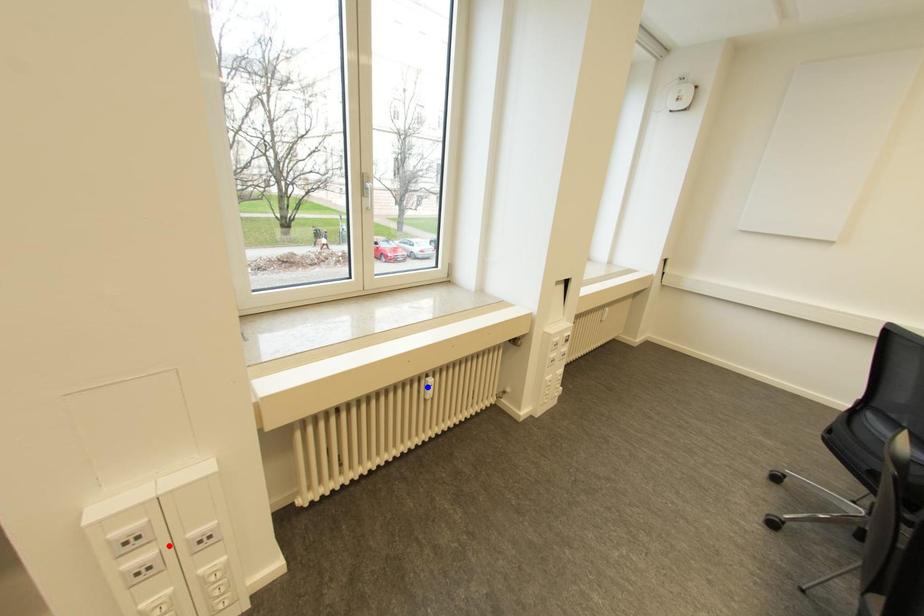
Question: Which of the two points in the image is closer to the camera?

Choices:
 (A) Blue point is closer.
 (B) Red point is closer.

Answer: (B)